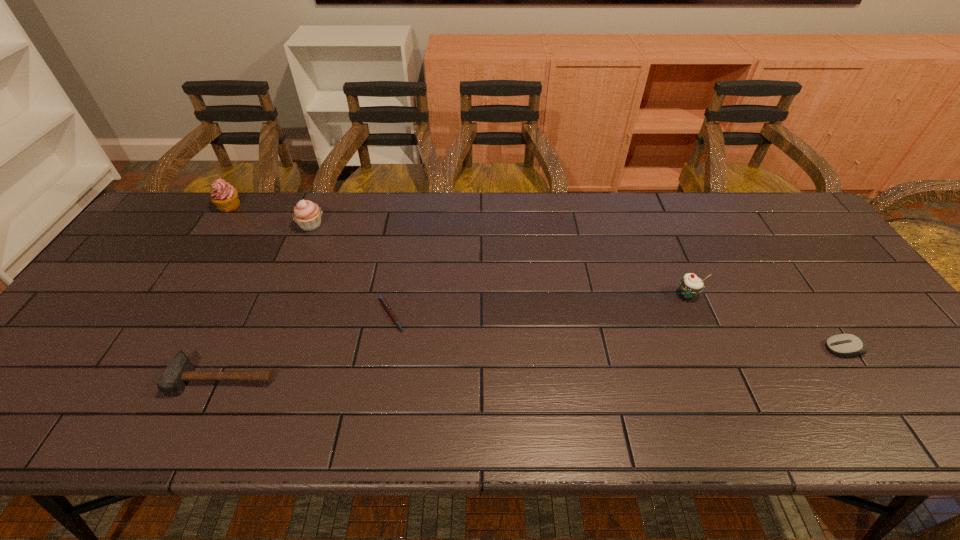
Find the location of a particular element. The height and width of the screenshot is (540, 960). vacant point that satisfies the following two spatial constraints: 1. on the wheel side of the second nearest object; 2. on the striking surface of the nearest object is located at coordinates (864, 377).